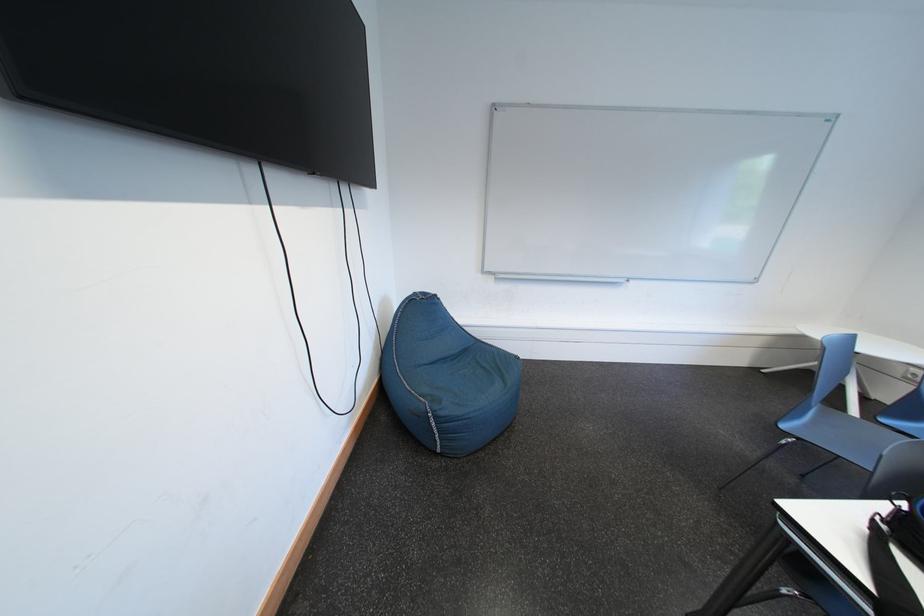
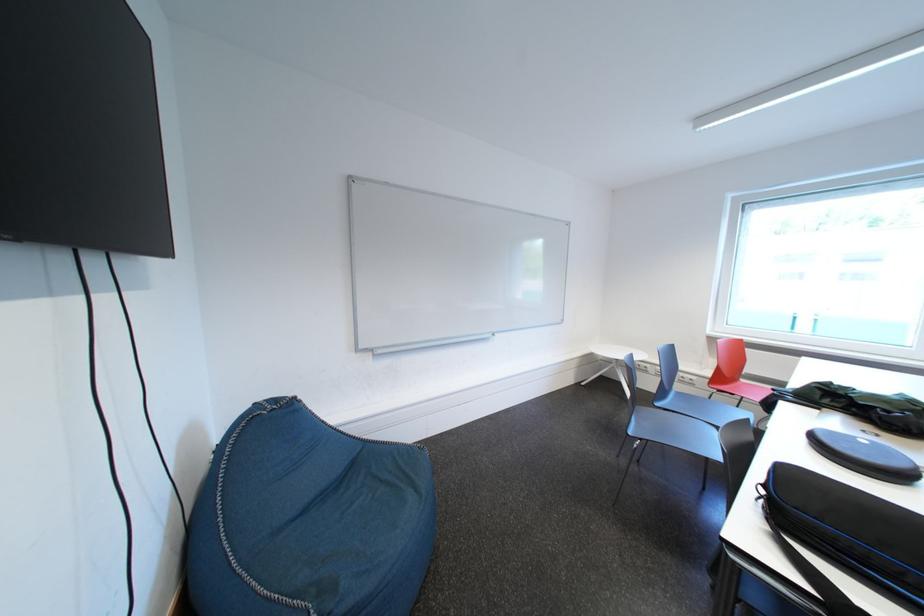
Find the pixel in the second image that matches pixel 490 370 in the first image.

(390, 484)